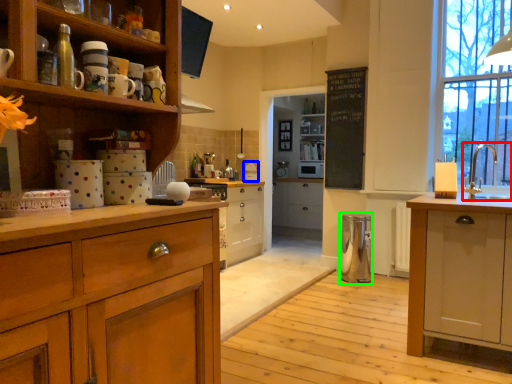
Question: Which is nearer to the sink (highlighted by a red box)? appliance (highlighted by a blue box) or appliance (highlighted by a green box).

Choices:
 (A) appliance
 (B) appliance

Answer: (B)